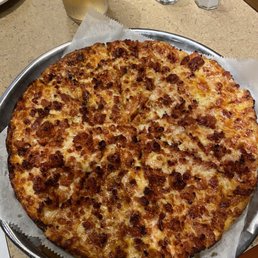
Locate an element on the screen. This screenshot has width=258, height=258. water glasses is located at coordinates (211, 9), (168, 2).